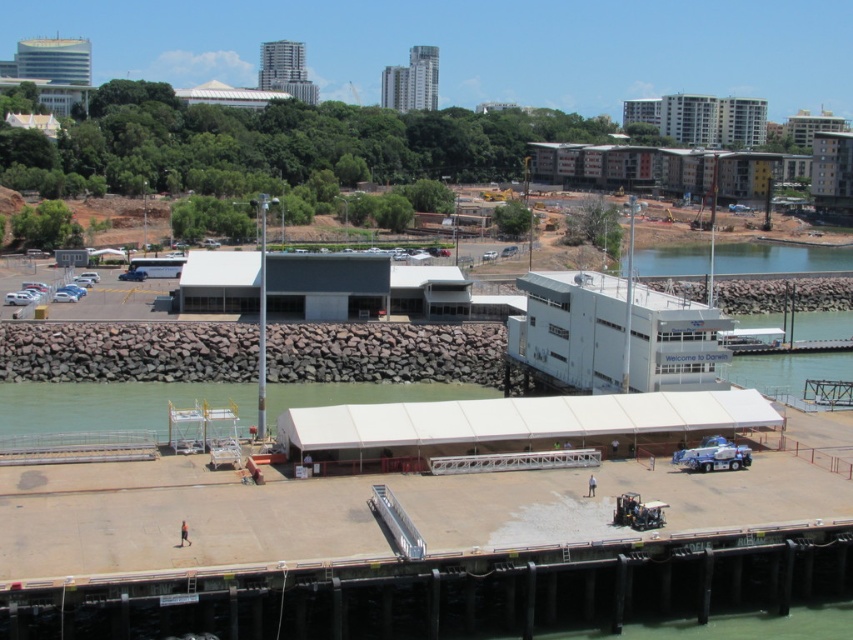
Question: Which of the following is the closest to the observer?

Choices:
 (A) (283, 406)
 (B) (660, 257)

Answer: (A)

Question: Does clear water at lower left have a lesser width compared to clear water at lower right?

Choices:
 (A) no
 (B) yes

Answer: (B)

Question: Which object is closer to the camera taking this photo?

Choices:
 (A) clear water at lower right
 (B) clear water at lower left

Answer: (B)

Question: Does clear water at lower left have a greater width compared to clear water at lower right?

Choices:
 (A) no
 (B) yes

Answer: (A)

Question: Is clear water at lower left smaller than clear water at lower right?

Choices:
 (A) no
 (B) yes

Answer: (B)